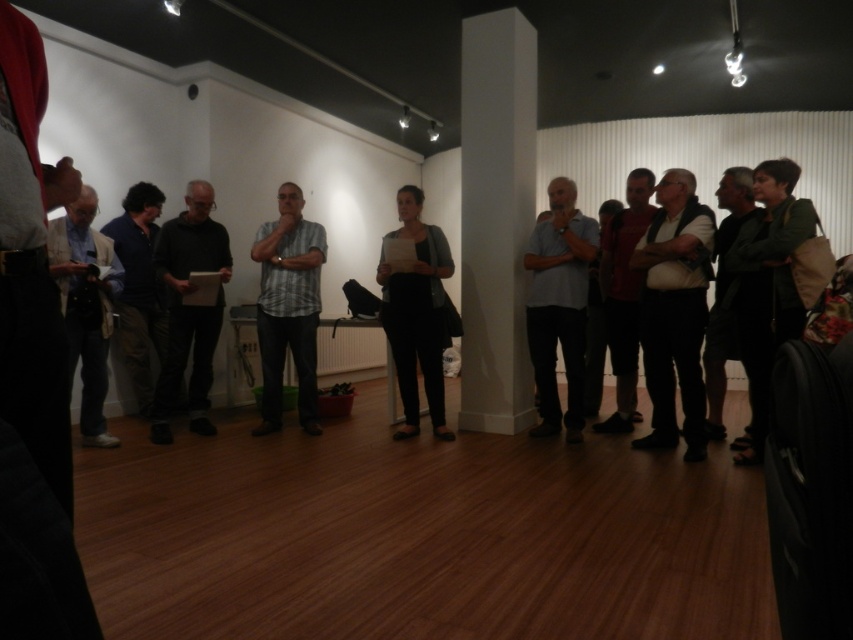
Can you confirm if striped cotton shirt at center is bigger than matte black pants at center?

Actually, striped cotton shirt at center might be smaller than matte black pants at center.

This screenshot has height=640, width=853. Describe the element at coordinates (288, 307) in the screenshot. I see `striped cotton shirt at center` at that location.

Image resolution: width=853 pixels, height=640 pixels. I want to click on striped cotton shirt at center, so click(288, 307).

Who is positioned more to the left, striped cotton shirt at center or dark red shirt at center?

From the viewer's perspective, striped cotton shirt at center appears more on the left side.

Looking at this image, which of these two, striped cotton shirt at center or dark red shirt at center, stands shorter?

Standing shorter between the two is striped cotton shirt at center.

Where is `striped cotton shirt at center`? The width and height of the screenshot is (853, 640). striped cotton shirt at center is located at coordinates (288, 307).

Does striped cotton shirt at center appear on the right side of dark gray fabric jacket at left?

Indeed, striped cotton shirt at center is positioned on the right side of dark gray fabric jacket at left.

Is point (265, 305) closer to camera compared to point (90, 321)?

That is False.

I want to click on striped cotton shirt at center, so click(x=288, y=307).